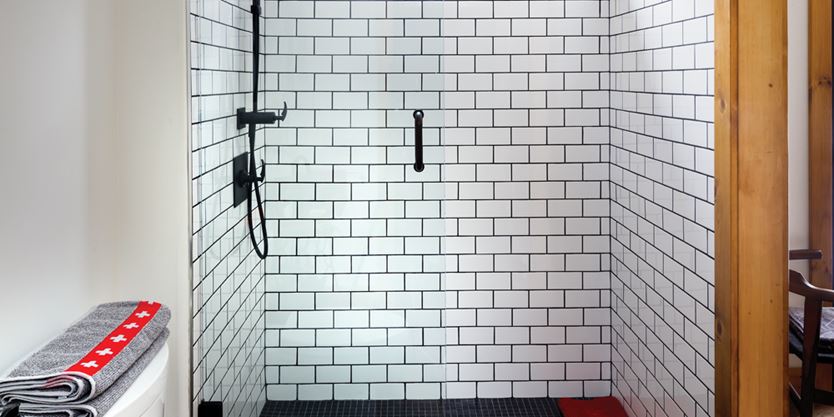
Identify the location of wood entranceway. The width and height of the screenshot is (834, 417). (760, 307).